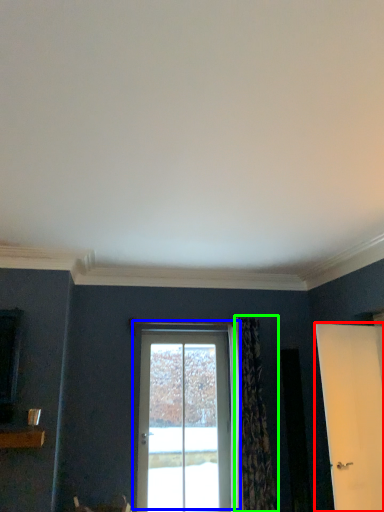
Question: Which object is the farthest from door (highlighted by a red box)? Choose among these: door (highlighted by a blue box) or curtain (highlighted by a green box).

Choices:
 (A) door
 (B) curtain

Answer: (A)